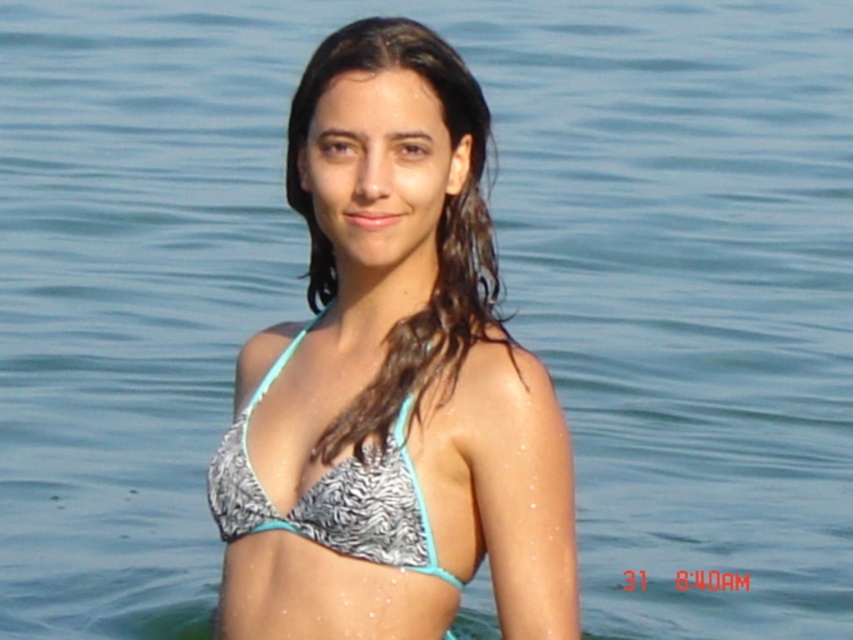
Based on the photo, you are a photographer trying to capture the person in the image. Which bikini top, the white printed bikini top at center or the teal fabric bikini top at center, is positioned in front of the other?

The white printed bikini top at center is closer to the viewer than the teal fabric bikini top at center, so it is positioned in front of the other.

Based on the coordinates provided, what object is located at point (392, 380) in the image?

The point (392, 380) marks the white printed bikini top at center.